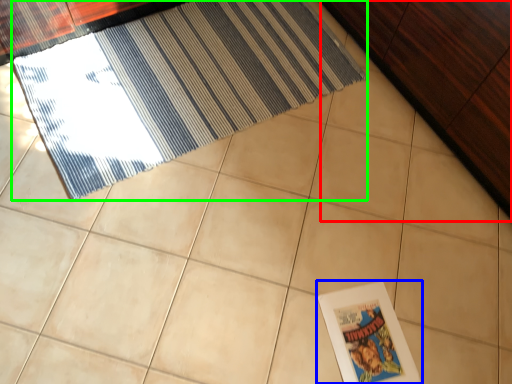
Question: Which object is positioned closest to dresser (highlighted by a red box)? Select from picture frame (highlighted by a blue box) and door (highlighted by a green box).

Choices:
 (A) picture frame
 (B) door

Answer: (B)